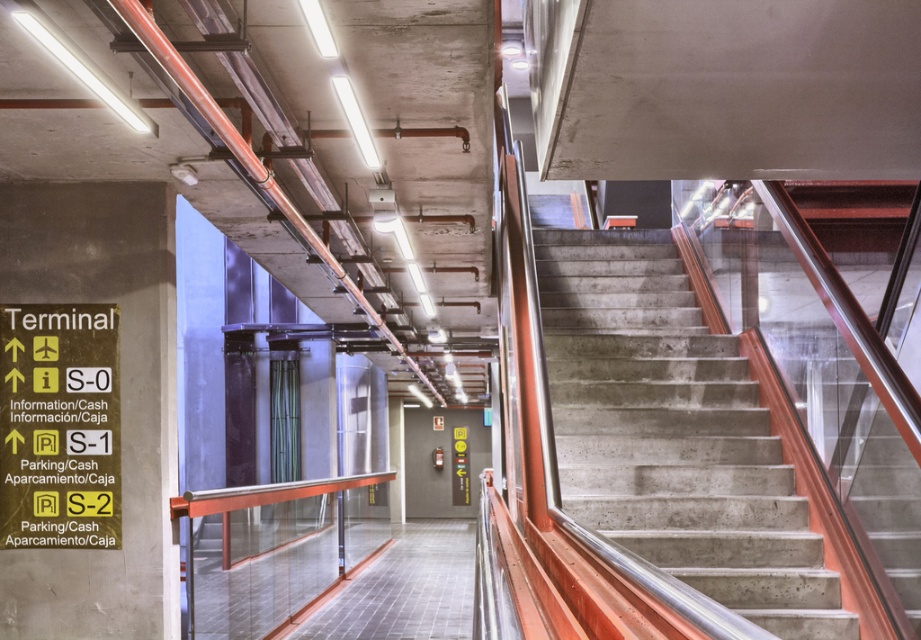
Between point (596, 288) and point (324, 554), which one is positioned behind?

Point (324, 554)

The width and height of the screenshot is (921, 640). What are the coordinates of `concrete/stained stairs at center` in the screenshot? It's located at (673, 433).